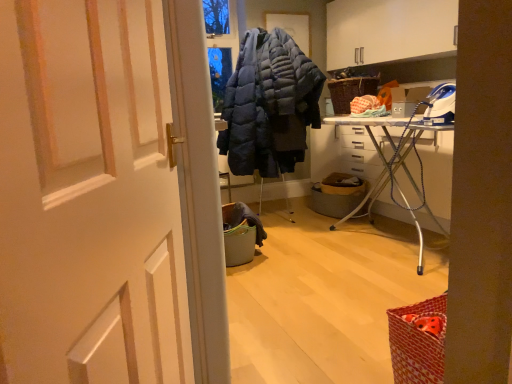
Question: Is dark blue quilted jacket at center located within white metal ironing board at center right?

Choices:
 (A) yes
 (B) no

Answer: (B)

Question: From a real-world perspective, is white metal ironing board at center right physically above dark blue quilted jacket at center?

Choices:
 (A) yes
 (B) no

Answer: (B)

Question: Does white metal ironing board at center right have a greater height compared to dark blue quilted jacket at center?

Choices:
 (A) yes
 (B) no

Answer: (B)

Question: Considering the relative sizes of white metal ironing board at center right and dark blue quilted jacket at center in the image provided, is white metal ironing board at center right wider than dark blue quilted jacket at center?

Choices:
 (A) no
 (B) yes

Answer: (A)

Question: From the image's perspective, is white metal ironing board at center right below dark blue quilted jacket at center?

Choices:
 (A) no
 (B) yes

Answer: (B)

Question: Does point (148, 284) appear closer or farther from the camera than point (287, 142)?

Choices:
 (A) farther
 (B) closer

Answer: (B)

Question: From their relative heights in the image, would you say white matte door at center is taller or shorter than dark blue quilted jacket at center?

Choices:
 (A) short
 (B) tall

Answer: (A)

Question: In the image, is white matte door at center positioned in front of or behind dark blue quilted jacket at center?

Choices:
 (A) behind
 (B) front

Answer: (B)

Question: Is white matte door at center bigger or smaller than dark blue quilted jacket at center?

Choices:
 (A) small
 (B) big

Answer: (A)

Question: Considering the positions of white metal ironing board at center right and metallic gray laundry basket at center in the image, is white metal ironing board at center right taller or shorter than metallic gray laundry basket at center?

Choices:
 (A) tall
 (B) short

Answer: (A)

Question: Choose the correct answer: Is white metal ironing board at center right inside metallic gray laundry basket at center or outside it?

Choices:
 (A) outside
 (B) inside

Answer: (A)

Question: Considering the positions of white metal ironing board at center right and metallic gray laundry basket at center in the image, is white metal ironing board at center right wider or thinner than metallic gray laundry basket at center?

Choices:
 (A) wide
 (B) thin

Answer: (A)

Question: Looking at the image, does white metal ironing board at center right seem bigger or smaller compared to metallic gray laundry basket at center?

Choices:
 (A) big
 (B) small

Answer: (A)

Question: Considering their positions, is dark blue quilted jacket at center located in front of or behind woven brown picnic basket at upper right?

Choices:
 (A) behind
 (B) front

Answer: (B)

Question: In terms of size, does dark blue quilted jacket at center appear bigger or smaller than woven brown picnic basket at upper right?

Choices:
 (A) big
 (B) small

Answer: (A)